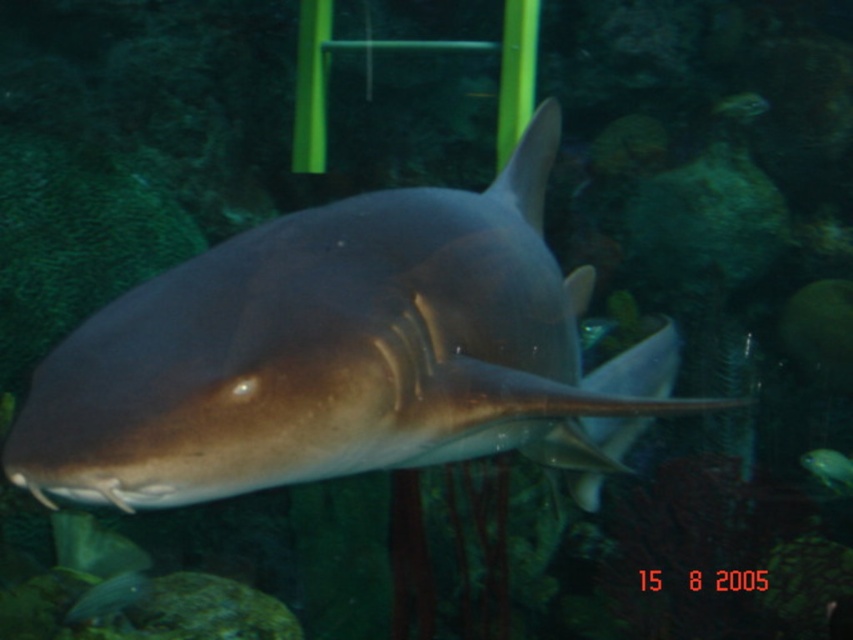
Question: From the image, what is the correct spatial relationship of smooth gray shark at center in relation to shiny blue fish at center?

Choices:
 (A) right
 (B) left

Answer: (B)

Question: Considering the real-world distances, which object is closest to the shiny blue fish at center?

Choices:
 (A) smooth gray shark at center
 (B) shiny silver fish at lower left

Answer: (B)

Question: Based on their relative distances, which object is farther from the shiny blue fish at center?

Choices:
 (A) smooth gray shark at center
 (B) shiny silver fish at lower left

Answer: (A)

Question: Estimate the real-world distances between objects in this image. Which object is farther from the shiny silver fish at lower left?

Choices:
 (A) smooth gray shark at center
 (B) shiny blue fish at center

Answer: (B)

Question: Is shiny silver fish at lower left closer to the viewer compared to shiny blue fish at center?

Choices:
 (A) yes
 (B) no

Answer: (A)

Question: Can you confirm if shiny silver fish at lower left is positioned to the left of shiny blue fish at center?

Choices:
 (A) no
 (B) yes

Answer: (B)